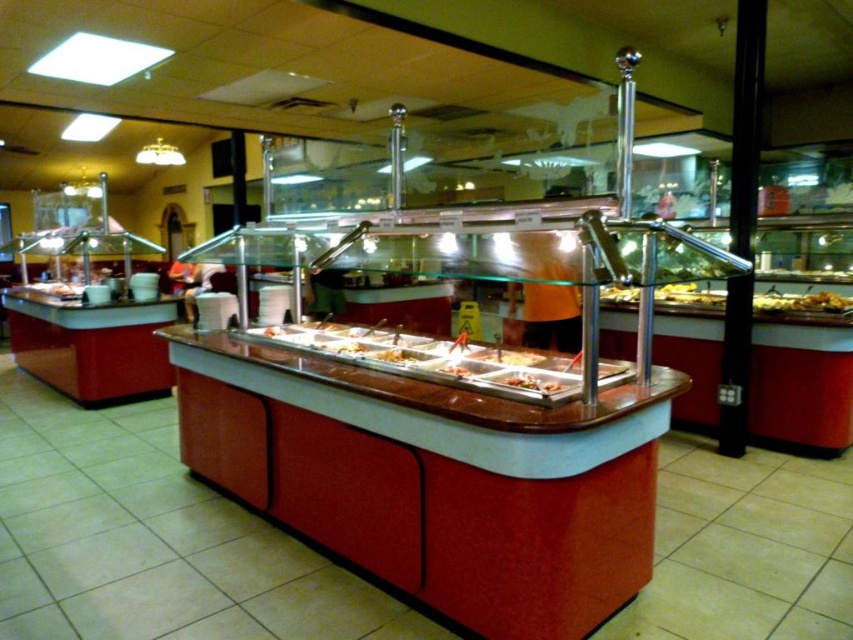
Which is above, white glossy food at center or white glossy tray at center?

white glossy tray at center

Is white glossy food at center further to camera compared to white glossy tray at center?

No.

Which is behind, point (503, 378) or point (341, 346)?

Point (341, 346)

Find the location of a particular element. This screenshot has width=853, height=640. white glossy food at center is located at coordinates (531, 381).

Is point (364, 348) in front of point (460, 374)?

No, it is not.

Who is more forward, (349, 342) or (460, 365)?

Positioned in front is point (460, 365).

Where is `white glossy tray at center`? The image size is (853, 640). white glossy tray at center is located at coordinates coord(350,348).

Which of these two, white glossy food at center or slightly browned plastic tray at center, stands taller?

white glossy food at center

Is white glossy food at center closer to camera compared to slightly browned plastic tray at center?

Yes, it is.

Does point (532, 378) lie in front of point (447, 371)?

Yes, point (532, 378) is closer to viewer.

Find the location of a particular element. white glossy food at center is located at coordinates (531, 381).